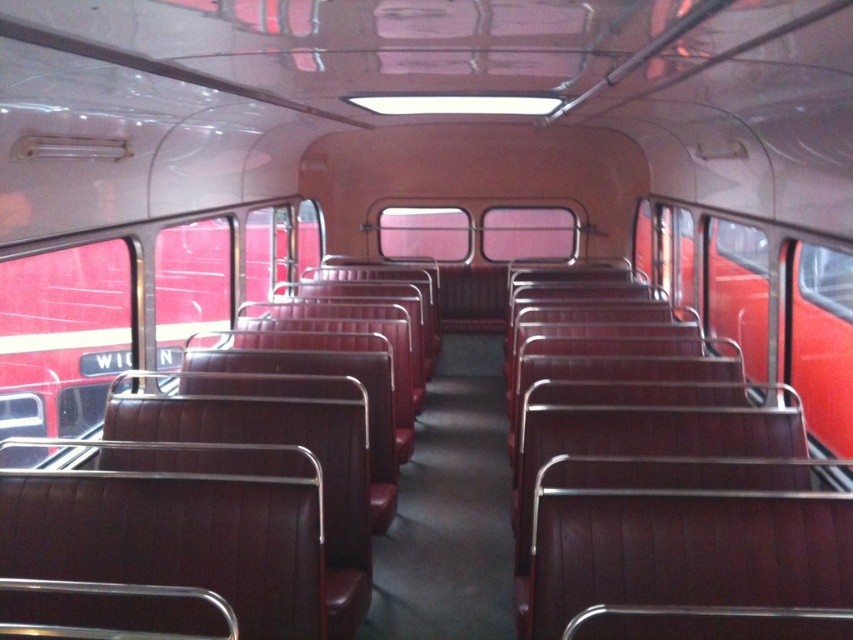
You are standing at the point marked by the coordinates point (492,234) in a vintage bus or train car. You want to walk to the door that is 10 meters away from your current position. Can you reach the door without moving more than 9 meters?

The distance between point (492,234) and the viewer is 8.80 meters. Since the door is 10 meters away, you would need to walk an additional 1.2 meters beyond your current position to reach it, which exceeds the 9 meters limit. Therefore, you cannot reach the door without moving more than 9 meters.